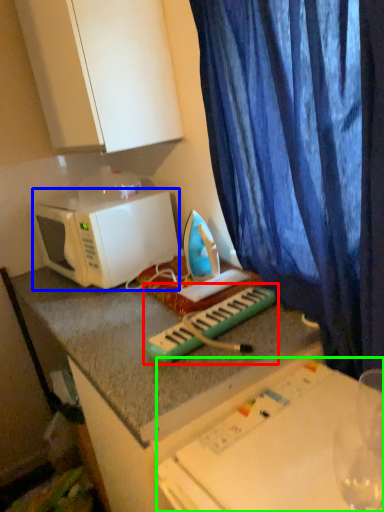
Question: Considering the real-world distances, which object is closest to musical keyboard (highlighted by a red box)? microwave oven (highlighted by a blue box) or table (highlighted by a green box).

Choices:
 (A) microwave oven
 (B) table

Answer: (B)